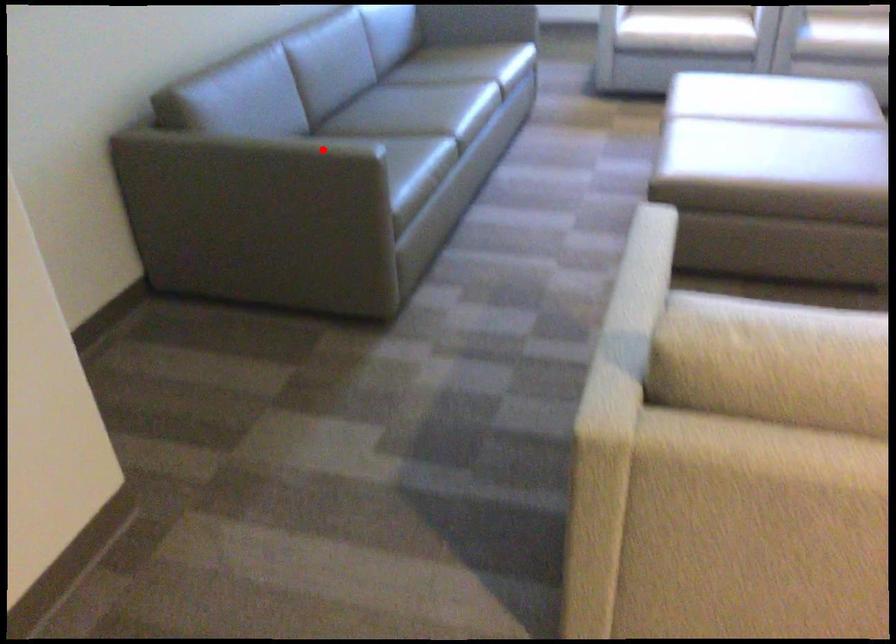
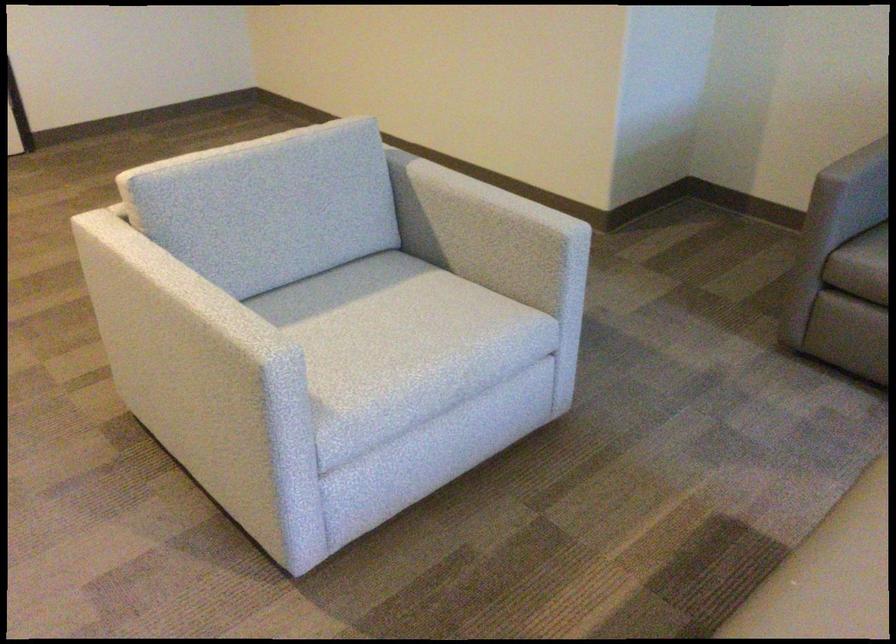
The point at the highlighted location is marked in the first image. Where is the corresponding point in the second image?

(858, 164)